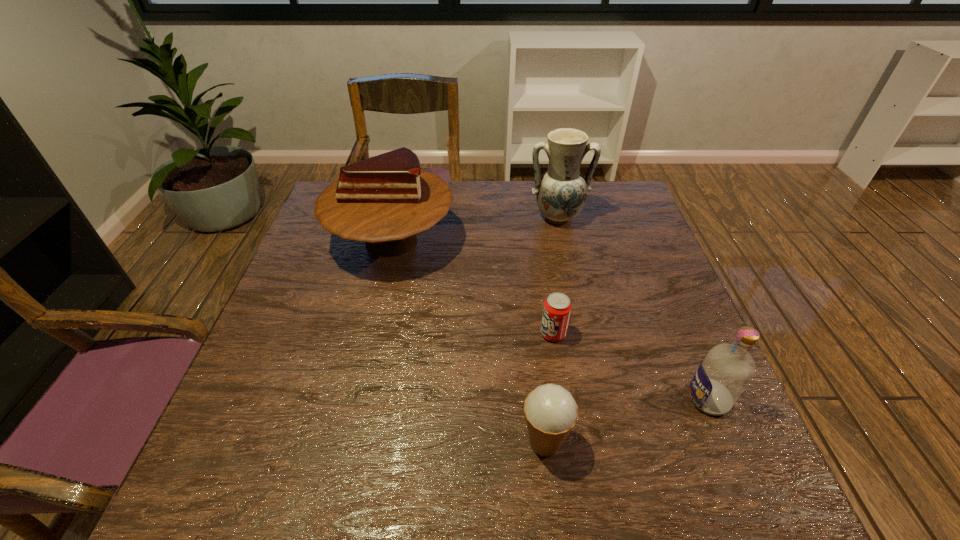
Locate an element on the screen. The width and height of the screenshot is (960, 540). pottery is located at coordinates (561, 192).

Image resolution: width=960 pixels, height=540 pixels. Identify the location of cake. (386, 200).

Locate an element on the screen. This screenshot has height=540, width=960. the third shortest object is located at coordinates (727, 369).

The width and height of the screenshot is (960, 540). What are the coordinates of `vodka` in the screenshot? It's located at [x=727, y=369].

The image size is (960, 540). In order to click on icecream in this screenshot , I will do `click(551, 412)`.

At what (x,y) coordinates should I click in order to perform the action: click on the nearest object. Please return your answer as a coordinate pair (x, y). This screenshot has height=540, width=960. Looking at the image, I should click on (551, 412).

You are a GUI agent. You are given a task and a screenshot of the screen. Output one action in this format:
    pyautogui.click(x=<x>, y=<y>)
    Task: Click on the shortest object
    This screenshot has height=540, width=960.
    Given the screenshot: What is the action you would take?
    pyautogui.click(x=557, y=307)

I want to click on the third nearest object, so click(x=557, y=307).

Locate an element on the screen. vacant region located on either side of the pottery is located at coordinates (578, 310).

You are a GUI agent. You are given a task and a screenshot of the screen. Output one action in this format:
    pyautogui.click(x=<x>, y=<y>)
    Task: Click on the free spot located 0.110m on the front of the cake
    This screenshot has height=540, width=960.
    Given the screenshot: What is the action you would take?
    pyautogui.click(x=373, y=317)